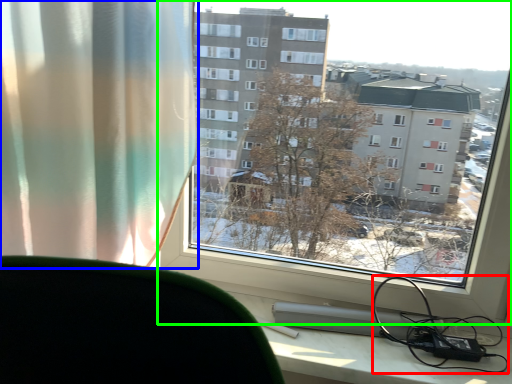
Question: Considering the real-world distances, which object is farthest from cable (highlighted by a red box)? curtain (highlighted by a blue box) or window (highlighted by a green box)?

Choices:
 (A) curtain
 (B) window

Answer: (A)